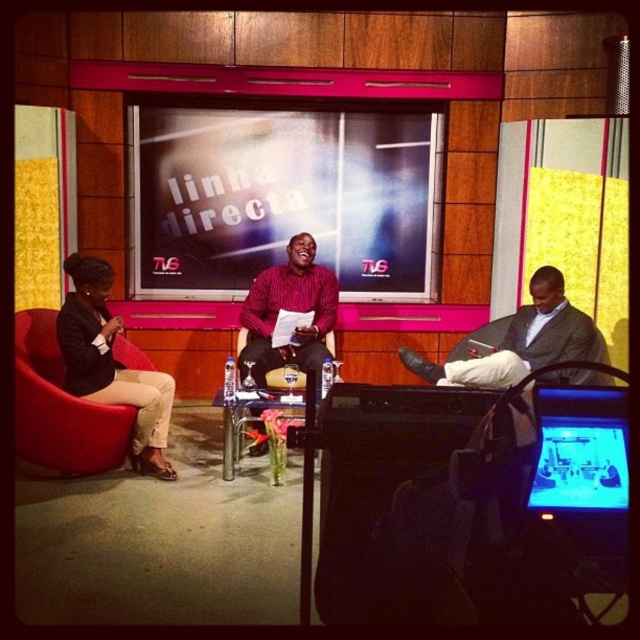
This screenshot has width=640, height=640. What are the coordinates of `blue glossy monitor at center` in the screenshot? It's located at [x=580, y=465].

What are the coordinates of `blue glossy monitor at center` in the screenshot? It's located at (580, 465).

Is light brown leather jacket at center below black leather armchair at center?

No.

Is light brown leather jacket at center positioned in front of black leather armchair at center?

No, it is behind black leather armchair at center.

This screenshot has height=640, width=640. Describe the element at coordinates (522, 339) in the screenshot. I see `light brown leather jacket at center` at that location.

This screenshot has height=640, width=640. I want to click on light brown leather jacket at center, so click(522, 339).

Does matte red shirt at center have a greater height compared to blue glossy monitor at center?

Correct, matte red shirt at center is much taller as blue glossy monitor at center.

Is point (264, 284) positioned behind point (577, 500)?

Yes, it is behind point (577, 500).

Does point (307, 237) come farther from viewer compared to point (620, 442)?

That is True.

Locate an element on the screen. matte red shirt at center is located at coordinates (289, 310).